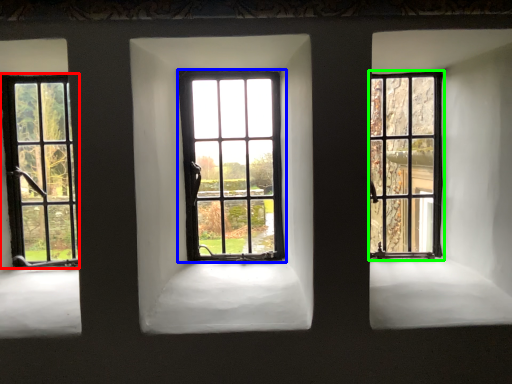
Question: Considering the real-world distances, which object is closest to window (highlighted by a red box)? window (highlighted by a blue box) or window (highlighted by a green box).

Choices:
 (A) window
 (B) window

Answer: (A)